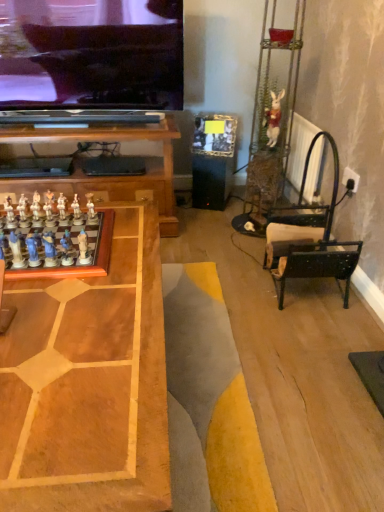
Question: Is white glossy chess piece at center-left, which is the 3th toy from right to left, directly adjacent to matte blue chess pieces at left, placed as the 9th toy when sorted from right to left?

Choices:
 (A) yes
 (B) no

Answer: (B)

Question: From the image's perspective, is white glossy chess piece at center-left, which is the 3th toy from right to left, located beneath matte blue chess pieces at left, placed as the 9th toy when sorted from right to left?

Choices:
 (A) no
 (B) yes

Answer: (A)

Question: Considering the relative sizes of white glossy chess piece at center-left, marked as the 10th toy in a front-to-back arrangement, and matte blue chess pieces at left, marked as the first toy in a front-to-back arrangement, in the image provided, is white glossy chess piece at center-left, marked as the 10th toy in a front-to-back arrangement, bigger than matte blue chess pieces at left, marked as the first toy in a front-to-back arrangement,?

Choices:
 (A) yes
 (B) no

Answer: (A)

Question: Is white glossy chess piece at center-left, which ranks as the second toy in back-to-front order, facing towards matte blue chess pieces at left, placed as the 9th toy when sorted from right to left?

Choices:
 (A) no
 (B) yes

Answer: (A)

Question: Considering the relative positions of white glossy chess piece at center-left, which ranks as the second toy in back-to-front order, and matte blue chess pieces at left, marked as the first toy in a front-to-back arrangement, in the image provided, is white glossy chess piece at center-left, which ranks as the second toy in back-to-front order, to the left of matte blue chess pieces at left, marked as the first toy in a front-to-back arrangement, from the viewer's perspective?

Choices:
 (A) yes
 (B) no

Answer: (B)

Question: Would you say wooden chessboard at center is to the left or to the right of matte blue chess piece at left, which is the eighth toy from back to front, in the picture?

Choices:
 (A) right
 (B) left

Answer: (B)

Question: From a real-world perspective, is wooden chessboard at center positioned above or below matte blue chess piece at left, which ranks as the fourth toy in front-to-back order?

Choices:
 (A) below
 (B) above

Answer: (A)

Question: In terms of width, does wooden chessboard at center look wider or thinner when compared to matte blue chess piece at left, which is counted as the fourth toy, starting from the right?

Choices:
 (A) thin
 (B) wide

Answer: (B)

Question: From the image's perspective, relative to matte blue chess piece at left, the eighth toy in the left-to-right sequence, is wooden chessboard at center above or below?

Choices:
 (A) below
 (B) above

Answer: (A)

Question: Considering the positions of white glossy chess set at lower left and white glossy chess piece at left, which appears as the 7th toy when viewed from the right, in the image, is white glossy chess set at lower left taller or shorter than white glossy chess piece at left, which appears as the 7th toy when viewed from the right,?

Choices:
 (A) tall
 (B) short

Answer: (B)

Question: Would you say white glossy chess set at lower left is to the left or to the right of white glossy chess piece at left, positioned as the 4th toy in back-to-front order, in the picture?

Choices:
 (A) left
 (B) right

Answer: (A)

Question: Is white glossy chess set at lower left in front of or behind white glossy chess piece at left, acting as the 8th toy starting from the front, in the image?

Choices:
 (A) front
 (B) behind

Answer: (A)

Question: Does point (71, 230) appear closer or farther from the camera than point (57, 206)?

Choices:
 (A) closer
 (B) farther

Answer: (A)

Question: In terms of height, does matte blue chess piece at left, which ranks as the fourth toy in front-to-back order, look taller or shorter compared to white glossy chess piece at left, which is the 6th toy in front-to-back order?

Choices:
 (A) tall
 (B) short

Answer: (A)

Question: Is matte blue chess piece at left, the eighth toy in the left-to-right sequence, wider or thinner than white glossy chess piece at left, the 11th toy when ordered from right to left?

Choices:
 (A) wide
 (B) thin

Answer: (A)